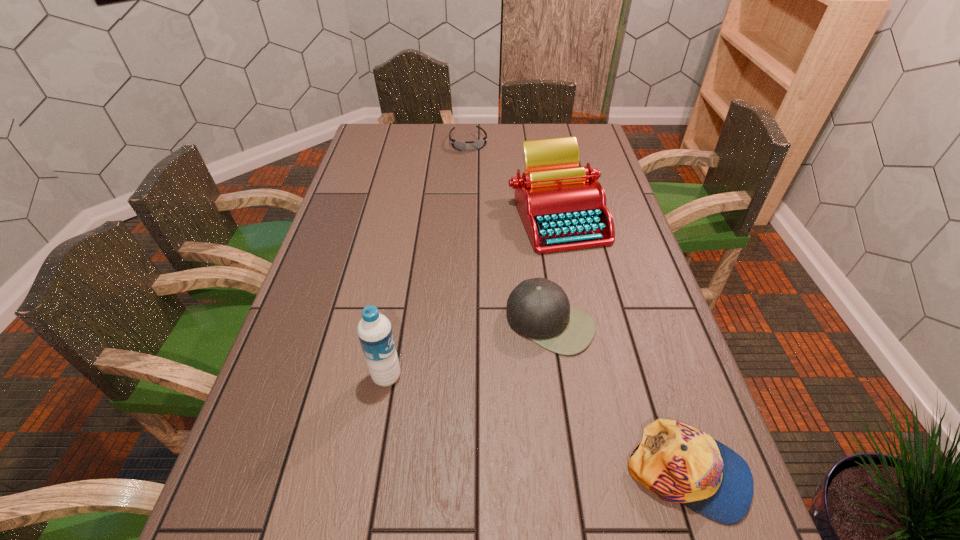
I want to click on free space between the leftmost object and the third farthest object, so click(x=468, y=350).

What are the coordinates of `free space between the farther cap and the shortest object` in the screenshot? It's located at (x=510, y=233).

The height and width of the screenshot is (540, 960). What are the coordinates of `empty space that is in between the third farthest object and the second tallest object` in the screenshot? It's located at (554, 270).

Where is `blank region between the second tallest object and the nearer cap`? The height and width of the screenshot is (540, 960). blank region between the second tallest object and the nearer cap is located at coordinates (622, 345).

Where is `vacant area that lies between the typewriter and the second nearest object`? The width and height of the screenshot is (960, 540). vacant area that lies between the typewriter and the second nearest object is located at coordinates (471, 296).

Where is `object identified as the closest to the nearest object`? This screenshot has height=540, width=960. object identified as the closest to the nearest object is located at coordinates (539, 309).

The image size is (960, 540). Find the location of `object that is the fourth closest to the shortest object`. object that is the fourth closest to the shortest object is located at coordinates (677, 462).